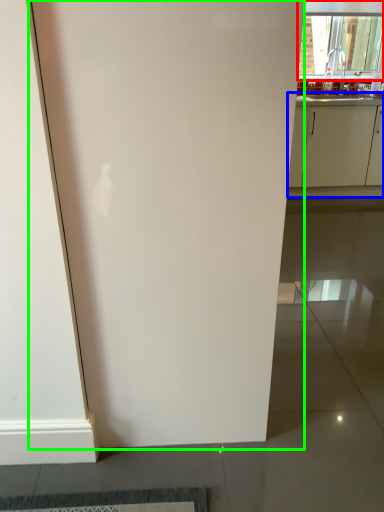
Question: Based on their relative distances, which object is nearer to window (highlighted by a red box)? Choose from cabinetry (highlighted by a blue box) and door (highlighted by a green box).

Choices:
 (A) cabinetry
 (B) door

Answer: (A)